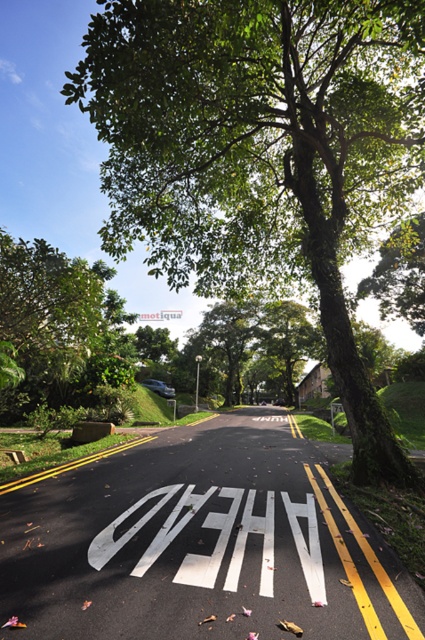
Question: Observing the image, what is the correct spatial positioning of green leafy tree at center in reference to white plastic sign at center?

Choices:
 (A) right
 (B) left

Answer: (A)

Question: Does green leafy tree at center lie in front of green leafy tree at upper left?

Choices:
 (A) no
 (B) yes

Answer: (B)

Question: Does green leafy tree at center have a greater width compared to white plastic sign at center?

Choices:
 (A) yes
 (B) no

Answer: (A)

Question: Which point is farther to the camera?

Choices:
 (A) (85, 321)
 (B) (197, 406)
 (C) (271, 252)

Answer: (B)

Question: Which is farther from the green leafy tree at center?

Choices:
 (A) green leafy tree at upper left
 (B) white plastic sign at center

Answer: (B)

Question: Which object is closer to the camera taking this photo?

Choices:
 (A) green leafy tree at upper left
 (B) white plastic sign at center
 (C) green leafy tree at center

Answer: (C)